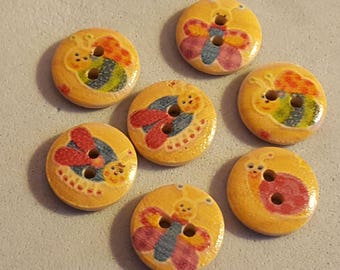
Image resolution: width=340 pixels, height=270 pixels. Find the location of `table`. table is located at coordinates pos(213,160).